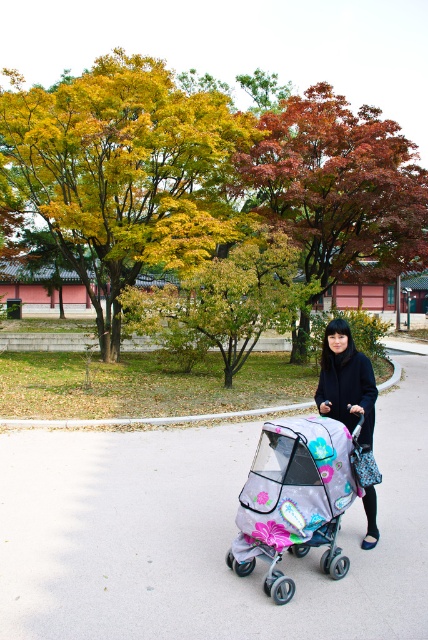
You are a delivery drone flying over a park. You need to land on the gray asphalt pavement at center. However, there is a black matte coat at center nearby. Which object is lower to the ground so you can safely land?

The gray asphalt pavement at center has a lesser height compared to the black matte coat at center, so you can safely land on the gray asphalt pavement at center.

You are standing on the paved pathway in the park scene and want to determine the relative positions of two points marked in the image. Which point, point 1 at coordinates (79,216) or point 2 at coordinates (314,480), is closer to you?

Point 1 at coordinates (79,216) is closer to you because it is further to the viewer than point 2 at coordinates (314,480).

You are a landscape architect designing a new park. You need to place a decorative fountain between the gray asphalt pavement at center and the autumn leaves at upper center. Given their distance apart is 15.26 meters, what is the minimum distance you should keep from each object to ensure the fountain is equidistant from both?

To place the fountain equidistant from both the gray asphalt pavement at center and autumn leaves at upper center, which are 15.26 meters apart, the fountain should be placed exactly halfway between them. This means the minimum distance from each object would be half of 15.26 meters, which is 7.63 meters.